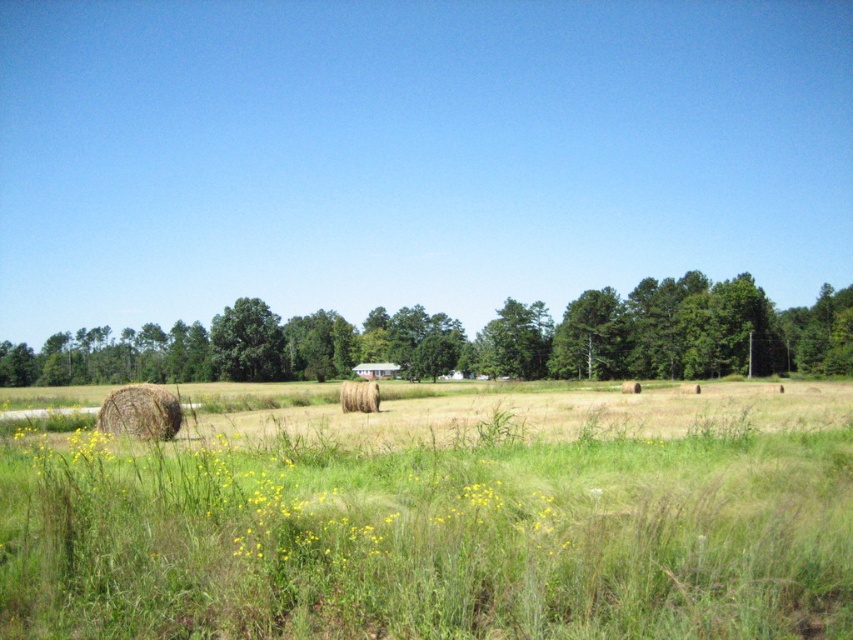
Question: Which point is farther from the camera taking this photo?

Choices:
 (A) (141, 586)
 (B) (692, 296)
 (C) (351, 400)

Answer: (B)

Question: Which of these objects is positioned farthest from the green leafy tree at center?

Choices:
 (A) brown textured hay bale at lower left
 (B) green matte tree at center

Answer: (A)

Question: Is green grassy field at center positioned in front of green matte tree at center?

Choices:
 (A) yes
 (B) no

Answer: (A)

Question: Is green matte tree at center below brown textured hay bale at lower left?

Choices:
 (A) yes
 (B) no

Answer: (B)

Question: Which point is closer to the camera?

Choices:
 (A) green matte tree at center
 (B) golden straw bale at center
 (C) green grassy field at center
 (D) brown textured hay bale at lower left

Answer: (C)

Question: Does green leafy tree at center have a greater width compared to green matte tree at center?

Choices:
 (A) no
 (B) yes

Answer: (B)